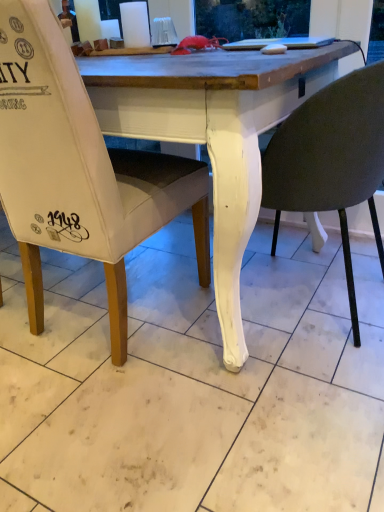
This screenshot has height=512, width=384. What do you see at coordinates (331, 159) in the screenshot?
I see `white matte chair at lower center, which appears as the 2th chair when viewed from the left` at bounding box center [331, 159].

This screenshot has height=512, width=384. What are the coordinates of `white matte chair at lower center, which appears as the 2th chair when viewed from the left` in the screenshot? It's located at (331, 159).

Measure the distance between point [344,248] and camera.

Point [344,248] is 4.07 feet from camera.

What is the approximate width of white fabric chair at left, arranged as the second chair when viewed from the right?

24.41 inches.

Locate an element on the screen. white fabric chair at left, the first chair positioned from the left is located at coordinates (79, 169).

What do you see at coordinates (79, 169) in the screenshot?
I see `white fabric chair at left, arranged as the second chair when viewed from the right` at bounding box center [79, 169].

What are the coordinates of `white matte chair at lower center, which appears as the 2th chair when viewed from the left` in the screenshot? It's located at (331, 159).

Considering the positions of objects white fabric chair at left, arranged as the second chair when viewed from the right, and white matte chair at lower center, marked as the 1th chair in a right-to-left arrangement, in the image provided, who is more to the right, white fabric chair at left, arranged as the second chair when viewed from the right, or white matte chair at lower center, marked as the 1th chair in a right-to-left arrangement,?

From the viewer's perspective, white matte chair at lower center, marked as the 1th chair in a right-to-left arrangement, appears more on the right side.

Relative to white matte chair at lower center, marked as the 1th chair in a right-to-left arrangement, is white fabric chair at left, the first chair positioned from the left, in front or behind?

white fabric chair at left, the first chair positioned from the left, is positioned closer to the viewer than white matte chair at lower center, marked as the 1th chair in a right-to-left arrangement.

Which is further, (148, 208) or (372, 157)?

Point (148, 208)

From the image's perspective, which is below, white fabric chair at left, the first chair positioned from the left, or white matte chair at lower center, which appears as the 2th chair when viewed from the left?

white matte chair at lower center, which appears as the 2th chair when viewed from the left, from the image's perspective.

From a real-world perspective, is white fabric chair at left, the first chair positioned from the left, on white matte chair at lower center, which appears as the 2th chair when viewed from the left?

Indeed, from a real-world perspective, white fabric chair at left, the first chair positioned from the left, stands above white matte chair at lower center, which appears as the 2th chair when viewed from the left.

Does white fabric chair at left, the first chair positioned from the left, have a greater width compared to white matte chair at lower center, which appears as the 2th chair when viewed from the left?

Yes, white fabric chair at left, the first chair positioned from the left, is wider than white matte chair at lower center, which appears as the 2th chair when viewed from the left.

Is white fabric chair at left, the first chair positioned from the left, taller than white matte chair at lower center, marked as the 1th chair in a right-to-left arrangement?

Yes, white fabric chair at left, the first chair positioned from the left, is taller than white matte chair at lower center, marked as the 1th chair in a right-to-left arrangement.

Between white fabric chair at left, arranged as the second chair when viewed from the right, and white matte chair at lower center, marked as the 1th chair in a right-to-left arrangement, which one has larger size?

Bigger between the two is white fabric chair at left, arranged as the second chair when viewed from the right.

Would you say white matte chair at lower center, which appears as the 2th chair when viewed from the left, is part of white fabric chair at left, arranged as the second chair when viewed from the right,'s contents?

No, white matte chair at lower center, which appears as the 2th chair when viewed from the left, is not surrounded by white fabric chair at left, arranged as the second chair when viewed from the right.

Is white fabric chair at left, arranged as the second chair when viewed from the right, with white matte chair at lower center, marked as the 1th chair in a right-to-left arrangement?

white fabric chair at left, arranged as the second chair when viewed from the right, and white matte chair at lower center, marked as the 1th chair in a right-to-left arrangement, are clearly separated.

Is white fabric chair at left, arranged as the second chair when viewed from the right, aimed at white matte chair at lower center, which appears as the 2th chair when viewed from the left?

No, white fabric chair at left, arranged as the second chair when viewed from the right, is not turned towards white matte chair at lower center, which appears as the 2th chair when viewed from the left.

How many degrees apart are the facing directions of white fabric chair at left, arranged as the second chair when viewed from the right, and white matte chair at lower center, marked as the 1th chair in a right-to-left arrangement?

The angular difference between white fabric chair at left, arranged as the second chair when viewed from the right, and white matte chair at lower center, marked as the 1th chair in a right-to-left arrangement, is 90 degrees.

This screenshot has width=384, height=512. I want to click on chair below the white fabric chair at left, the first chair positioned from the left (from the image's perspective), so click(x=331, y=159).

Is white matte chair at lower center, which appears as the 2th chair when viewed from the left, to the left of white fabric chair at left, the first chair positioned from the left, from the viewer's perspective?

No, white matte chair at lower center, which appears as the 2th chair when viewed from the left, is not to the left of white fabric chair at left, the first chair positioned from the left.

Is white matte chair at lower center, which appears as the 2th chair when viewed from the left, behind white fabric chair at left, the first chair positioned from the left?

Yes, white matte chair at lower center, which appears as the 2th chair when viewed from the left, is further from the camera.

Is point (320, 122) behind point (138, 207)?

No.

From the image's perspective, is white matte chair at lower center, marked as the 1th chair in a right-to-left arrangement, on white fabric chair at left, arranged as the second chair when viewed from the right?

No, from the image's perspective, white matte chair at lower center, marked as the 1th chair in a right-to-left arrangement, is not on top of white fabric chair at left, arranged as the second chair when viewed from the right.

From a real-world perspective, is white matte chair at lower center, which appears as the 2th chair when viewed from the left, physically above white fabric chair at left, arranged as the second chair when viewed from the right?

Incorrect, from a real-world perspective, white matte chair at lower center, which appears as the 2th chair when viewed from the left, is lower than white fabric chair at left, arranged as the second chair when viewed from the right.

Considering the sizes of white matte chair at lower center, marked as the 1th chair in a right-to-left arrangement, and white fabric chair at left, the first chair positioned from the left, in the image, is white matte chair at lower center, marked as the 1th chair in a right-to-left arrangement, wider or thinner than white fabric chair at left, the first chair positioned from the left,?

Considering their sizes, white matte chair at lower center, marked as the 1th chair in a right-to-left arrangement, looks slimmer than white fabric chair at left, the first chair positioned from the left.

Between white matte chair at lower center, which appears as the 2th chair when viewed from the left, and white fabric chair at left, arranged as the second chair when viewed from the right, which one has less height?

With less height is white matte chair at lower center, which appears as the 2th chair when viewed from the left.

Which of these two, white matte chair at lower center, marked as the 1th chair in a right-to-left arrangement, or white fabric chair at left, arranged as the second chair when viewed from the right, is bigger?

Bigger between the two is white fabric chair at left, arranged as the second chair when viewed from the right.

Does white matte chair at lower center, which appears as the 2th chair when viewed from the left, contain white fabric chair at left, arranged as the second chair when viewed from the right?

No.

Would you consider white matte chair at lower center, marked as the 1th chair in a right-to-left arrangement, to be distant from white fabric chair at left, the first chair positioned from the left?

No, there isn't a large distance between white matte chair at lower center, marked as the 1th chair in a right-to-left arrangement, and white fabric chair at left, the first chair positioned from the left.

Consider the image. Does white matte chair at lower center, marked as the 1th chair in a right-to-left arrangement, turn towards white fabric chair at left, arranged as the second chair when viewed from the right?

No, white matte chair at lower center, marked as the 1th chair in a right-to-left arrangement, does not turn towards white fabric chair at left, arranged as the second chair when viewed from the right.

Can you tell me how much white matte chair at lower center, which appears as the 2th chair when viewed from the left, and white fabric chair at left, the first chair positioned from the left, differ in facing direction?

90 degrees separate the facing orientations of white matte chair at lower center, which appears as the 2th chair when viewed from the left, and white fabric chair at left, the first chair positioned from the left.

Measure the distance between white matte chair at lower center, which appears as the 2th chair when viewed from the left, and white fabric chair at left, arranged as the second chair when viewed from the right.

A distance of 19.01 inches exists between white matte chair at lower center, which appears as the 2th chair when viewed from the left, and white fabric chair at left, arranged as the second chair when viewed from the right.

Find the location of a particular element. chair behind the white fabric chair at left, the first chair positioned from the left is located at coordinates (331, 159).

I want to click on chair on the right of white fabric chair at left, arranged as the second chair when viewed from the right, so click(331, 159).

Identify the location of chair below the white fabric chair at left, the first chair positioned from the left (from the image's perspective). (331, 159).